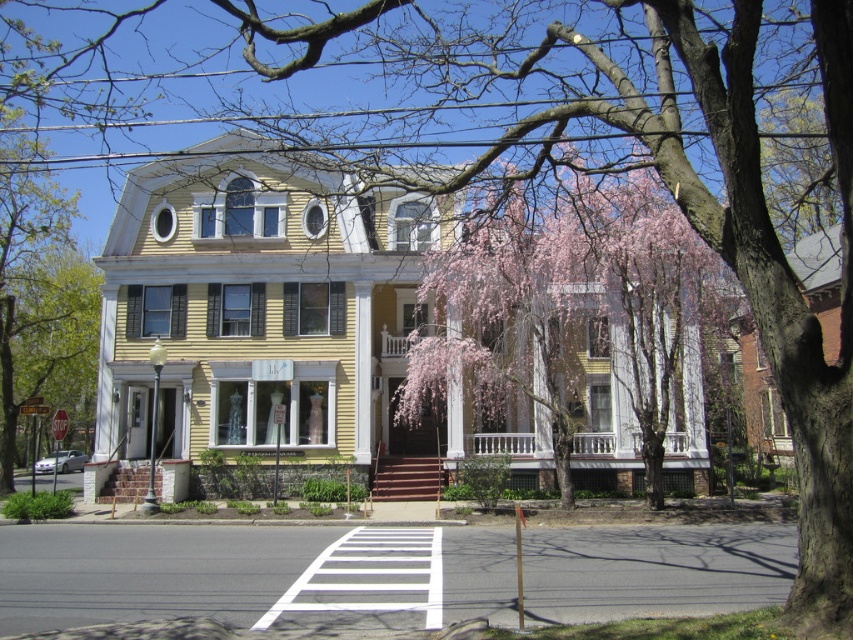
Question: Can you confirm if pink blossoming branches at center is positioned to the left of white painted wood porch at center?

Choices:
 (A) yes
 (B) no

Answer: (B)

Question: Is pink blossoming branches at center to the left of white painted wood porch at center from the viewer's perspective?

Choices:
 (A) no
 (B) yes

Answer: (A)

Question: Which point is closer to the camera taking this photo?

Choices:
 (A) (573, 224)
 (B) (677, 444)

Answer: (A)

Question: Which of the following is the farthest from the observer?

Choices:
 (A) (608, 442)
 (B) (447, 250)

Answer: (A)

Question: Where is pink blossoming branches at center located in relation to white painted wood porch at center in the image?

Choices:
 (A) below
 (B) above

Answer: (B)